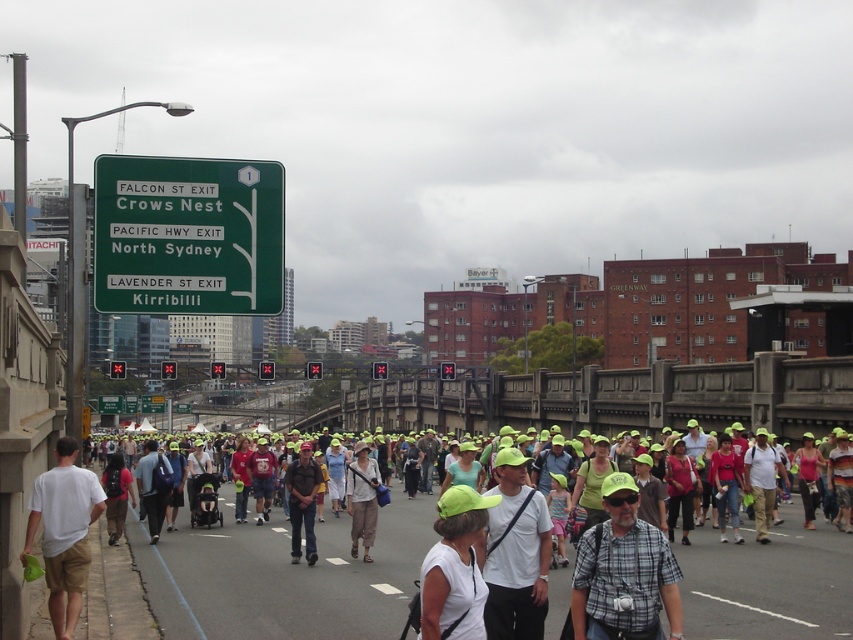
Question: Which of these objects is positioned closest to the light beige cotton shirt at center?

Choices:
 (A) white matte cap at center
 (B) green plastic sign at upper left

Answer: (A)

Question: Which of these objects is positioned farthest from the green plastic sign at upper left?

Choices:
 (A) green metallic sign at upper center
 (B) smooth asphalt road at center

Answer: (A)

Question: Which of these objects is positioned farthest from the dark brown leather jacket at center?

Choices:
 (A) plaid shirt at center
 (B) white cotton t-shirt at left

Answer: (A)

Question: Does dark brown leather jacket at center appear under green plastic sign at upper left?

Choices:
 (A) yes
 (B) no

Answer: (B)

Question: In this image, where is smooth asphalt road at center located relative to white matte t-shirt at center?

Choices:
 (A) above
 (B) below

Answer: (B)

Question: Can you confirm if white matte t-shirt at center is bigger than white matte cap at center?

Choices:
 (A) yes
 (B) no

Answer: (A)